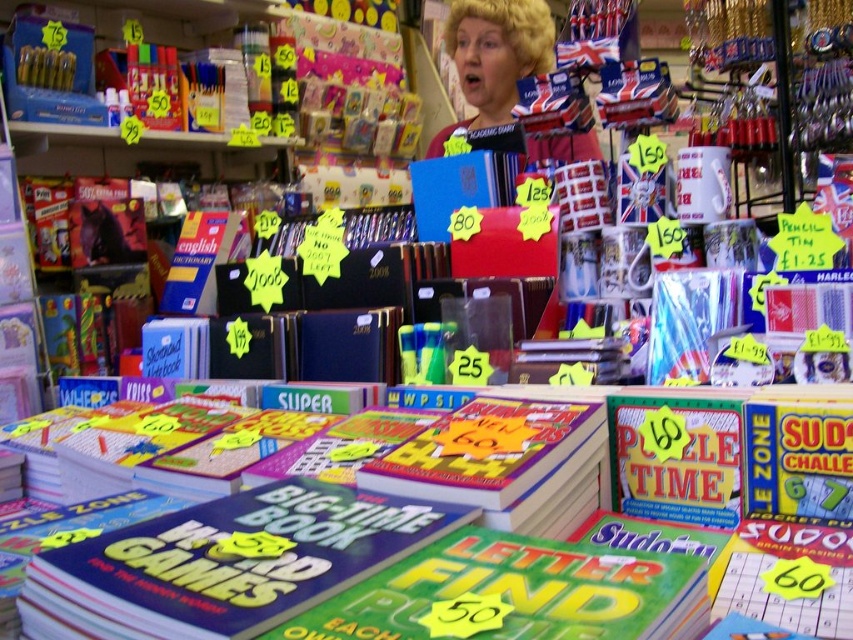
Question: Can you confirm if matte yellow book at center is smaller than blonde hair at upper center?

Choices:
 (A) no
 (B) yes

Answer: (B)

Question: Which of the following is the farthest from the observer?

Choices:
 (A) matte yellow book at center
 (B) blonde hair at upper center

Answer: (B)

Question: Which point appears farthest from the camera in this image?

Choices:
 (A) (529, 33)
 (B) (238, 634)

Answer: (A)

Question: Can you confirm if matte yellow book at center is positioned to the right of blonde hair at upper center?

Choices:
 (A) no
 (B) yes

Answer: (A)

Question: From the image, what is the correct spatial relationship of matte yellow book at center in relation to blonde hair at upper center?

Choices:
 (A) above
 (B) below

Answer: (B)